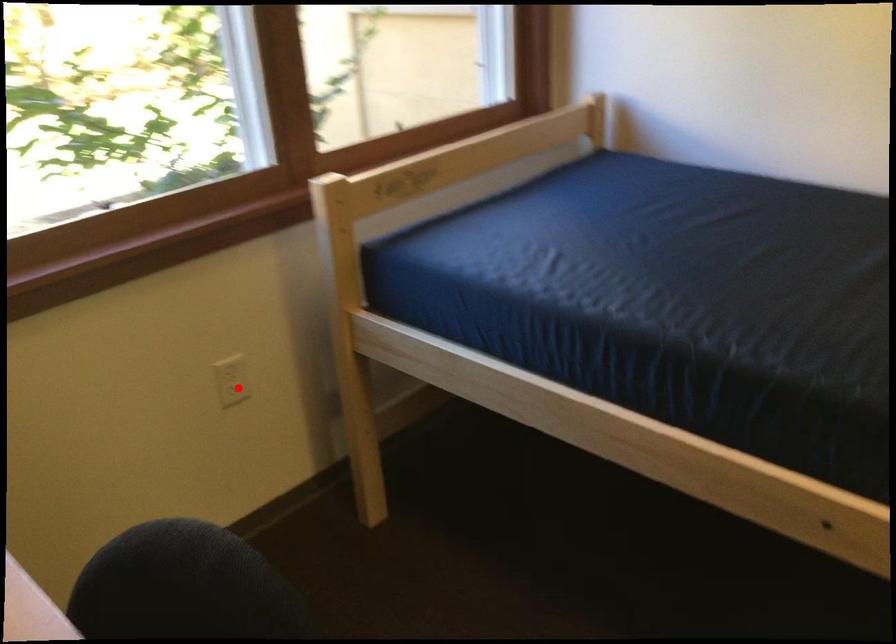
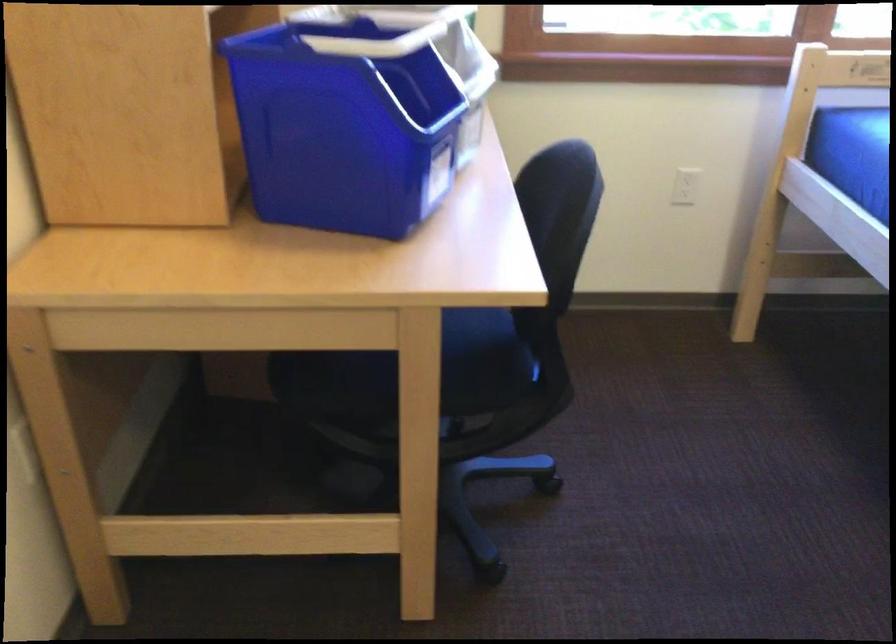
Question: I am providing you with two images of the same scene from different viewpoints. Given a red point in image1, look at the same physical point in image2. Is it:

Choices:
 (A) Closer to the viewpoint
 (B) Farther from the viewpoint

Answer: (B)